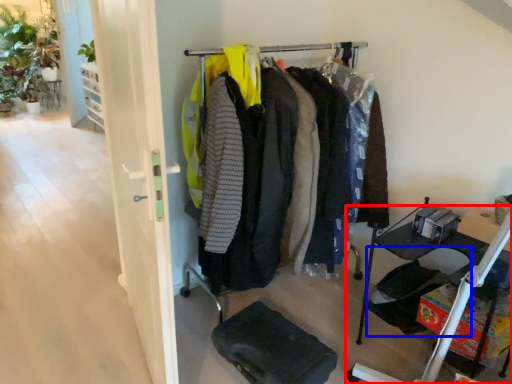
Question: Which object is further to the camera taking this photo, furniture (highlighted by a red box) or folding chair (highlighted by a blue box)?

Choices:
 (A) furniture
 (B) folding chair

Answer: (B)